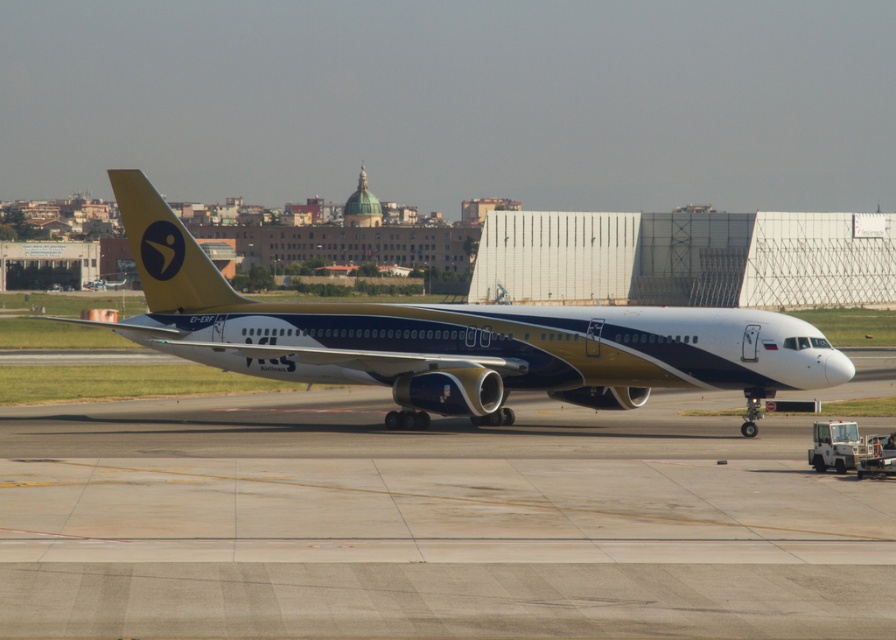
Question: Is the position of smooth concrete tarmac at center more distant than that of white/golden airplane at center?

Choices:
 (A) yes
 (B) no

Answer: (B)

Question: Is white/golden airplane at center closer to the viewer compared to yellow matte airplane tail at upper left?

Choices:
 (A) yes
 (B) no

Answer: (A)

Question: Among these points, which one is farthest from the camera?

Choices:
 (A) (616, 326)
 (B) (173, 284)
 (C) (582, 580)

Answer: (B)

Question: Which is nearer to the smooth concrete tarmac at center?

Choices:
 (A) yellow matte airplane tail at upper left
 (B) white/golden airplane at center

Answer: (B)

Question: Can you confirm if white/golden airplane at center is positioned to the right of yellow matte airplane tail at upper left?

Choices:
 (A) yes
 (B) no

Answer: (B)

Question: Which point is farther to the camera?

Choices:
 (A) (132, 220)
 (B) (306, 557)
 (C) (530, 378)

Answer: (A)